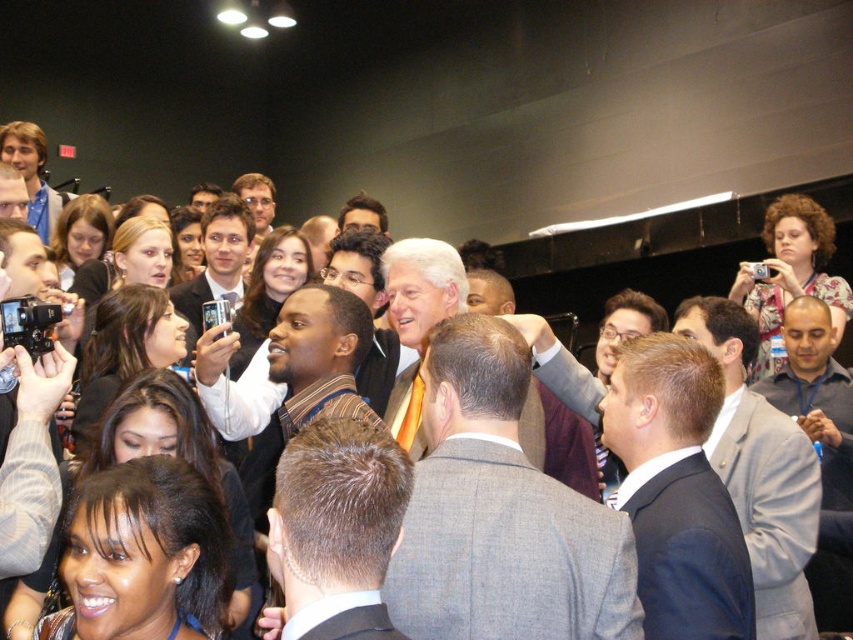
The image size is (853, 640). Describe the element at coordinates (677, 492) in the screenshot. I see `dark gray suit at center` at that location.

Can you confirm if dark gray suit at center is bigger than light brown suit at center?

Actually, dark gray suit at center might be smaller than light brown suit at center.

Between point (676, 420) and point (573, 428), which one is positioned behind?

The point (573, 428) is behind.

This screenshot has width=853, height=640. What are the coordinates of `dark gray suit at center` in the screenshot? It's located at (677, 492).

Can you confirm if dark gray suit at center is thinner than matte black glasses at upper center?

Correct, dark gray suit at center's width is less than matte black glasses at upper center's.

From the picture: Can you confirm if dark gray suit at center is taller than matte black glasses at upper center?

Correct, dark gray suit at center is much taller as matte black glasses at upper center.

Is point (718, 516) positioned in front of point (262, 218)?

Yes, point (718, 516) is in front of point (262, 218).

Identify the location of dark gray suit at center. Image resolution: width=853 pixels, height=640 pixels. (677, 492).

Is orange tie at center below matte black camera at lower left?

No, orange tie at center is not below matte black camera at lower left.

Can you confirm if orange tie at center is taller than matte black camera at lower left?

A: Yes, orange tie at center is taller than matte black camera at lower left.

Find the location of a particular element. orange tie at center is located at coordinates (500, 513).